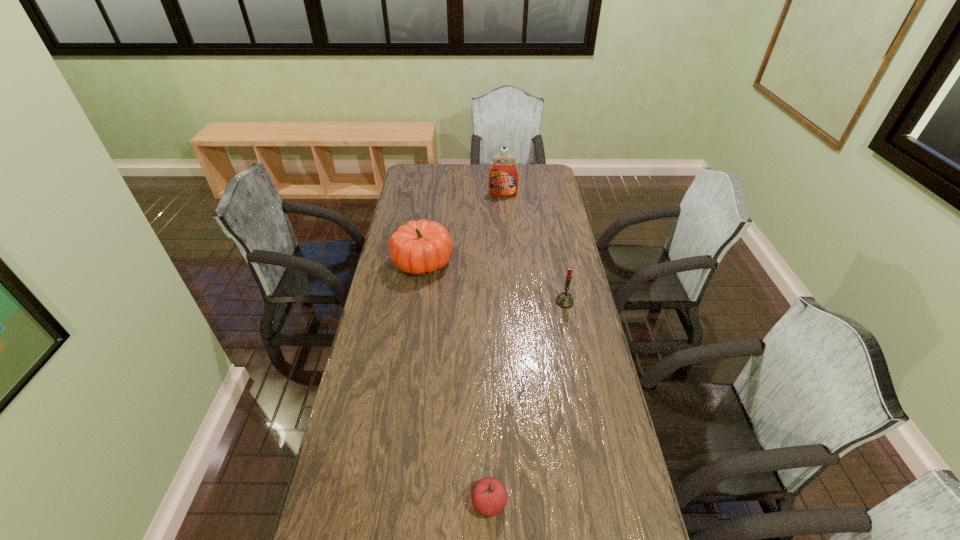
Image resolution: width=960 pixels, height=540 pixels. I want to click on vacant space that satisfies the following two spatial constraints: 1. on the front surface of the tallest object; 2. on the left side of the candle, so click(511, 302).

At what (x,y) coordinates should I click in order to perform the action: click on vacant area that satisfies the following two spatial constraints: 1. on the front surface of the tallest object; 2. on the right side of the third farthest object. Please return your answer as a coordinate pair (x, y). Looking at the image, I should click on (511, 302).